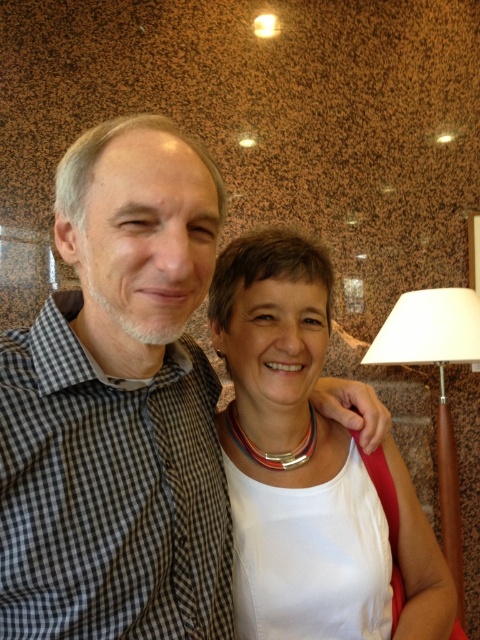
Question: Where is white matte necklace at center located in relation to wooden base lampshade at right in the image?

Choices:
 (A) right
 (B) left

Answer: (B)

Question: Which object appears farthest from the camera in this image?

Choices:
 (A) wooden base lampshade at right
 (B) checkered fabric shirt at center
 (C) white matte necklace at center

Answer: (A)

Question: Which object is farther from the camera taking this photo?

Choices:
 (A) wooden base lampshade at right
 (B) checkered fabric shirt at center

Answer: (A)

Question: Which point is farther from the camera taking this photo?

Choices:
 (A) (452, 465)
 (B) (275, 483)

Answer: (A)

Question: Is checkered fabric shirt at center further to the viewer compared to white matte necklace at center?

Choices:
 (A) no
 (B) yes

Answer: (A)

Question: In this image, where is checkered fabric shirt at center located relative to white matte necklace at center?

Choices:
 (A) above
 (B) below

Answer: (A)